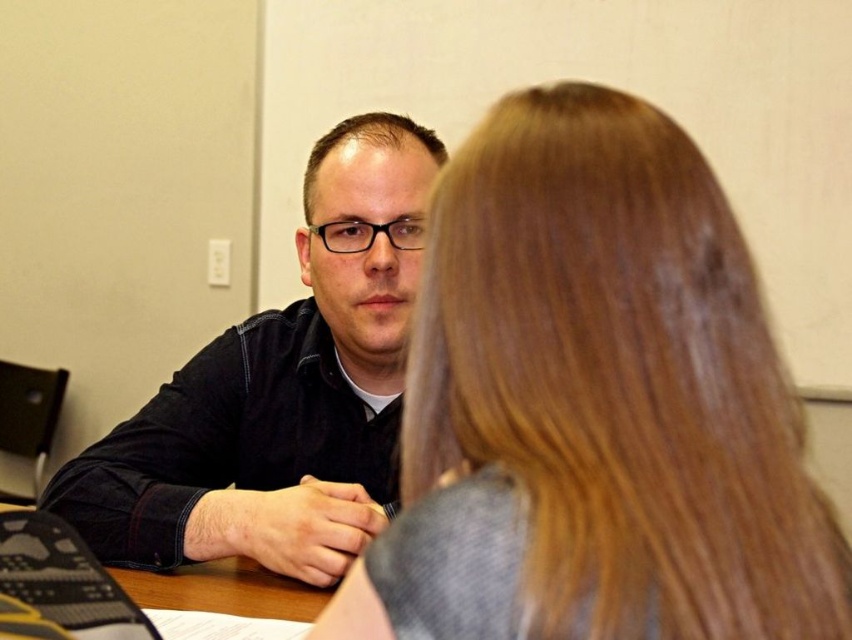
The image size is (852, 640). Identify the location of smooth brown hair at center. (594, 404).

The width and height of the screenshot is (852, 640). In order to click on smooth brown hair at center in this screenshot , I will do `click(594, 404)`.

The width and height of the screenshot is (852, 640). I want to click on smooth brown hair at center, so click(x=594, y=404).

Can you confirm if dark blue shirt at center is shorter than brown wood table at center?

No, dark blue shirt at center is not shorter than brown wood table at center.

Can you confirm if dark blue shirt at center is positioned below brown wood table at center?

Actually, dark blue shirt at center is above brown wood table at center.

What do you see at coordinates (280, 392) in the screenshot? I see `dark blue shirt at center` at bounding box center [280, 392].

Where is `dark blue shirt at center`? dark blue shirt at center is located at coordinates (280, 392).

Is smooth brown hair at center positioned at the back of dark blue shirt at center?

No.

Is point (758, 442) behind point (354, 284)?

That is False.

Locate an element on the screen. The height and width of the screenshot is (640, 852). smooth brown hair at center is located at coordinates (594, 404).